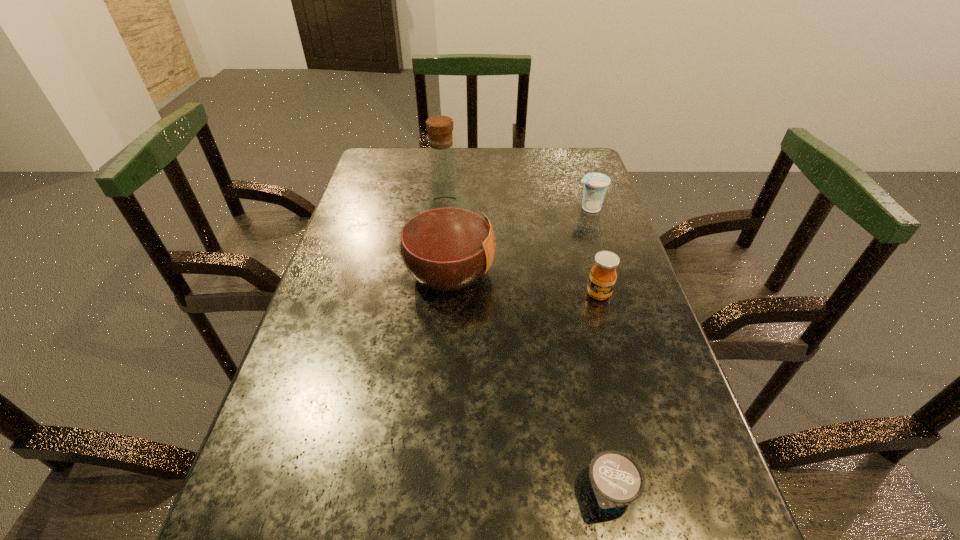
Identify the location of free region that satisfies the following two spatial constraints: 1. on the front label of the left yogurt; 2. on the right side of the tallest object. Image resolution: width=960 pixels, height=540 pixels. (433, 491).